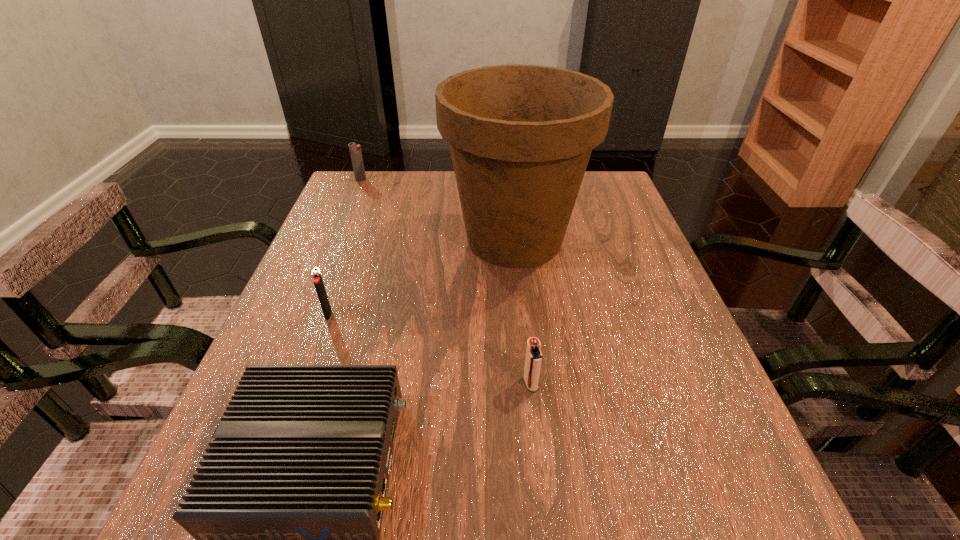
Locate an element on the screen. This screenshot has width=960, height=540. blank space located 0.140m on the back of the third farthest object is located at coordinates (347, 263).

The height and width of the screenshot is (540, 960). I want to click on vacant space located on the front of the rightmost igniter, so click(x=538, y=450).

Locate an element on the screen. The height and width of the screenshot is (540, 960). flowerpot located at the far edge is located at coordinates (520, 136).

Locate an element on the screen. igniter that is at the far edge is located at coordinates (355, 151).

Locate an element on the screen. object located at the right edge is located at coordinates (520, 136).

This screenshot has height=540, width=960. I want to click on object that is at the far left corner, so pos(355,151).

Where is `object located at the far right corner`? The image size is (960, 540). object located at the far right corner is located at coordinates [520, 136].

Identify the location of vacant space at the far edge of the desktop. Image resolution: width=960 pixels, height=540 pixels. (427, 197).

This screenshot has height=540, width=960. In the image, there is a desktop. What are the coordinates of `vacant space at the near edge` in the screenshot? It's located at (396, 488).

You are a GUI agent. You are given a task and a screenshot of the screen. Output one action in this format:
    pyautogui.click(x=<x>, y=<y>)
    Task: Click on the free space at the left edge
    The width and height of the screenshot is (960, 540).
    Given the screenshot: What is the action you would take?
    pyautogui.click(x=348, y=271)